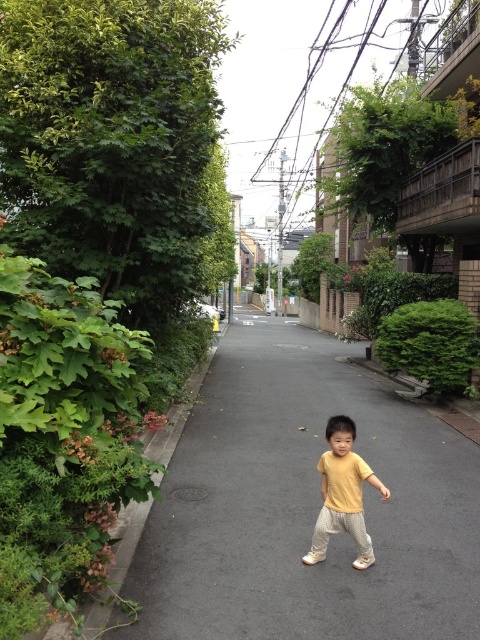
Question: Is black asphalt pavement at center positioned before yellow matte shirt at center?

Choices:
 (A) yes
 (B) no

Answer: (A)

Question: Which of the following is the farthest from the observer?

Choices:
 (A) (344, 445)
 (B) (324, 376)

Answer: (B)

Question: Does black asphalt pavement at center have a smaller size compared to yellow matte shirt at center?

Choices:
 (A) yes
 (B) no

Answer: (B)

Question: Observing the image, what is the correct spatial positioning of black asphalt pavement at center in reference to yellow matte shirt at center?

Choices:
 (A) left
 (B) right

Answer: (B)

Question: Among these objects, which one is nearest to the camera?

Choices:
 (A) black asphalt pavement at center
 (B) yellow matte shirt at center

Answer: (A)